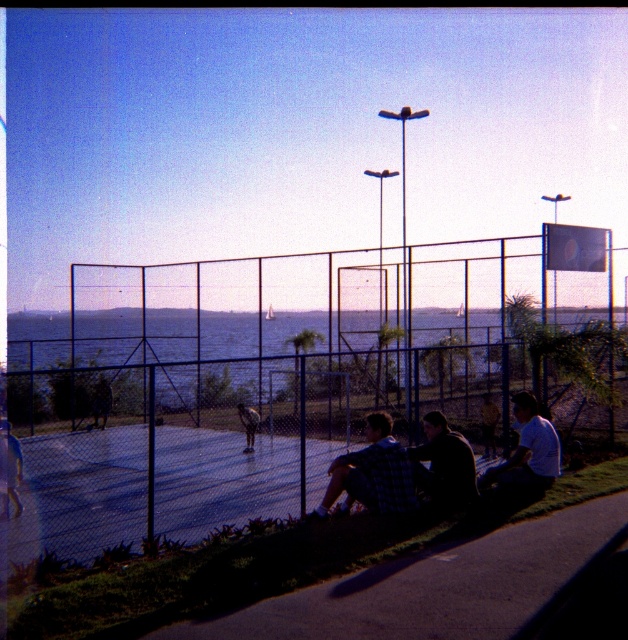
Question: Considering the relative positions of smooth asphalt pavement at lower center and plaid fabric shirt at lower center in the image provided, where is smooth asphalt pavement at lower center located with respect to plaid fabric shirt at lower center?

Choices:
 (A) left
 (B) right

Answer: (B)

Question: Is plaid fabric shirt at lower center positioned at the back of dark blue shirt at lower center?

Choices:
 (A) no
 (B) yes

Answer: (A)

Question: Which point appears farthest from the camera in this image?

Choices:
 (A) (609, 292)
 (B) (394, 493)
 (C) (536, 486)
 (D) (443, 436)

Answer: (A)

Question: Estimate the real-world distances between objects in this image. Which object is closer to the plaid fabric shirt at lower center?

Choices:
 (A) light blue shirt at lower right
 (B) dark blue shirt at lower center
 (C) smooth asphalt pavement at lower center

Answer: (B)

Question: Which of the following is the farthest from the observer?

Choices:
 (A) click(x=387, y=486)
 (B) click(x=512, y=456)
 (C) click(x=457, y=632)

Answer: (B)

Question: Can you confirm if blue wire mesh fence at center is positioned to the right of light blue shirt at lower right?

Choices:
 (A) no
 (B) yes

Answer: (A)